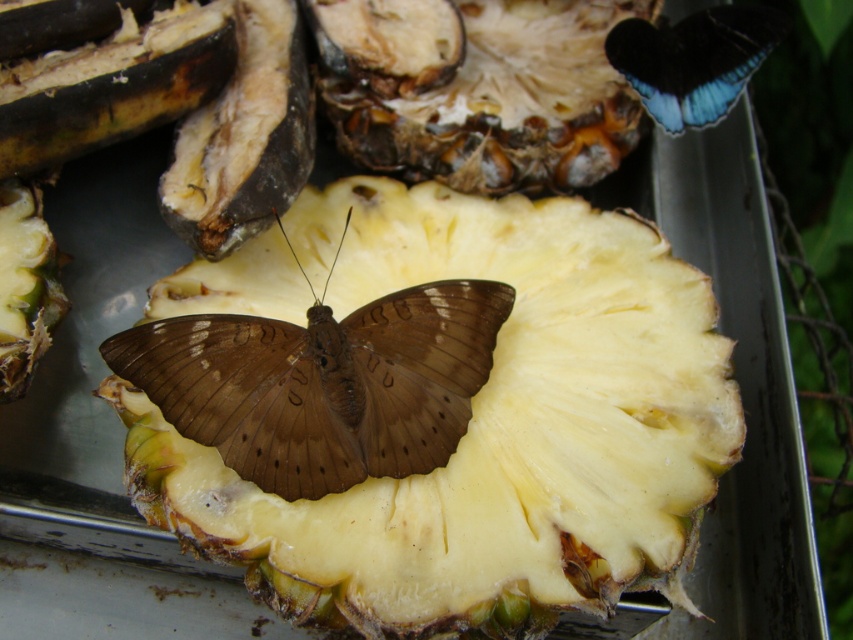
Which is above, yellowish matte pineapple at center or brown matte butterfly at center?

brown matte butterfly at center is above.

Based on the photo, is yellowish matte pineapple at center behind brown matte butterfly at center?

No, yellowish matte pineapple at center is in front of brown matte butterfly at center.

You are a GUI agent. You are given a task and a screenshot of the screen. Output one action in this format:
    pyautogui.click(x=<x>, y=<y>)
    Task: Click on the yellowish matte pineapple at center
    The width and height of the screenshot is (853, 640).
    Given the screenshot: What is the action you would take?
    (485, 428)

Where is `yellowish matte pineapple at center`? The height and width of the screenshot is (640, 853). yellowish matte pineapple at center is located at coordinates (485, 428).

Locate an element on the screen. The width and height of the screenshot is (853, 640). yellowish matte pineapple at center is located at coordinates (485, 428).

Is point (695, 305) farther from viewer compared to point (759, 61)?

No, (695, 305) is in front of (759, 61).

Which is behind, point (242, 291) or point (660, 45)?

Point (660, 45)

The image size is (853, 640). In order to click on yellowish matte pineapple at center in this screenshot , I will do `click(485, 428)`.

Does brown matte butterfly at center appear on the left side of blue glossy butterfly at upper right?

Yes, brown matte butterfly at center is to the left of blue glossy butterfly at upper right.

Describe the element at coordinates (322, 384) in the screenshot. I see `brown matte butterfly at center` at that location.

Which is behind, point (248, 333) or point (666, 28)?

Positioned behind is point (666, 28).

You are a GUI agent. You are given a task and a screenshot of the screen. Output one action in this format:
    pyautogui.click(x=<x>, y=<y>)
    Task: Click on the brown matte butterfly at center
    The image size is (853, 640).
    Given the screenshot: What is the action you would take?
    pyautogui.click(x=322, y=384)